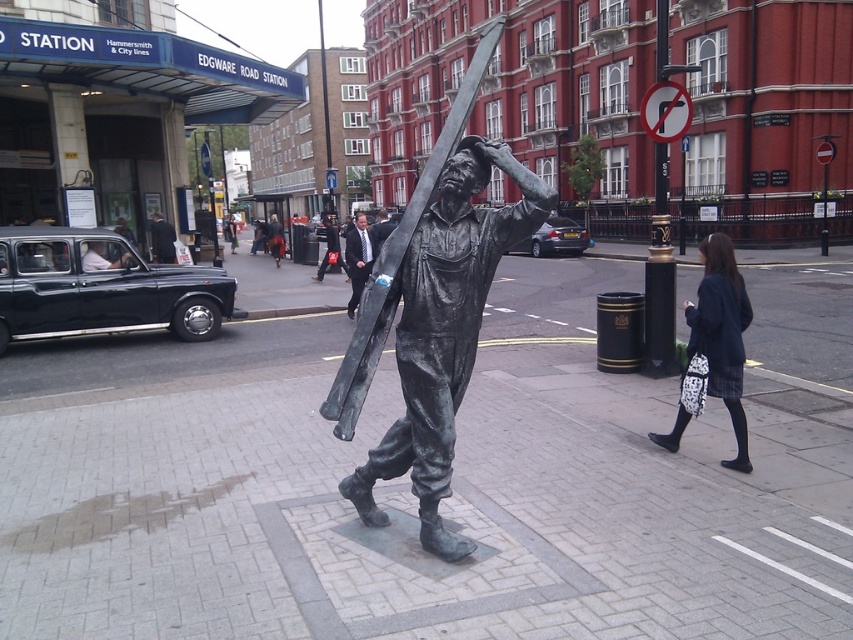
You are a tour guide leading a group near Edgware Road Station. You want to ensure everyone can see both the bronze statue at center and the dark blue suit at center clearly. Given the average human eye can focus clearly on objects at least 20 feet away, can the group view both items comfortably from their current position?

The distance between the bronze statue at center and the dark blue suit at center is 32.91 feet, which is greater than the 20 feet minimum required for clear focus. Therefore, the group can comfortably view both items from their current position.